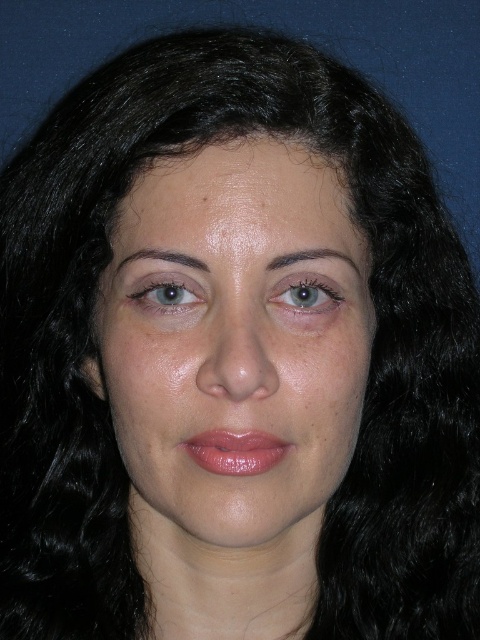
Question: Can you confirm if smooth skin face at center is positioned below pink glossy lips at center?

Choices:
 (A) yes
 (B) no

Answer: (B)

Question: Among these objects, which one is farthest from the camera?

Choices:
 (A) pink glossy lips at center
 (B) light brown eye at center
 (C) matte skin eye at upper left
 (D) smooth skin face at center

Answer: (B)

Question: Which object appears farthest from the camera in this image?

Choices:
 (A) pink glossy lips at center
 (B) light brown eye at center
 (C) matte skin eye at upper left
 (D) smooth skin face at center

Answer: (B)

Question: Which point is farther to the camera?

Choices:
 (A) light brown eye at center
 (B) pink glossy lips at center
 (C) smooth skin face at center
 (D) matte skin eye at upper left

Answer: (A)

Question: Where is smooth skin face at center located in relation to light brown eye at center in the image?

Choices:
 (A) left
 (B) right

Answer: (A)

Question: Considering the relative positions of smooth skin face at center and pink glossy lips at center in the image provided, where is smooth skin face at center located with respect to pink glossy lips at center?

Choices:
 (A) above
 (B) below

Answer: (A)